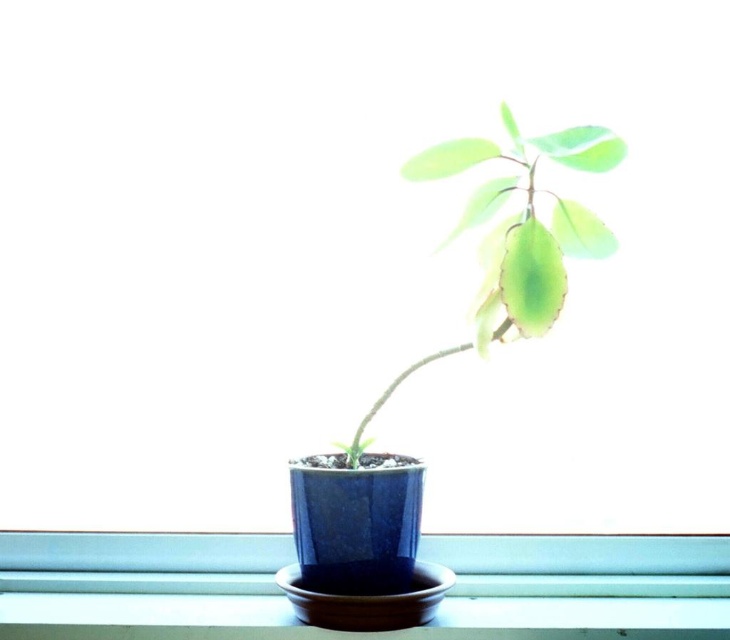
Is point (560, 204) more distant than point (515, 289)?

That is True.

Where is `green matte leafy plant at center`? green matte leafy plant at center is located at coordinates (514, 234).

Is point (550, 291) farther from camera compared to point (556, 268)?

No, it is not.

At what (x,y) coordinates should I click in order to perform the action: click on green matte leafy plant at center. Please return your answer as a coordinate pair (x, y). The image size is (730, 640). Looking at the image, I should click on (514, 234).